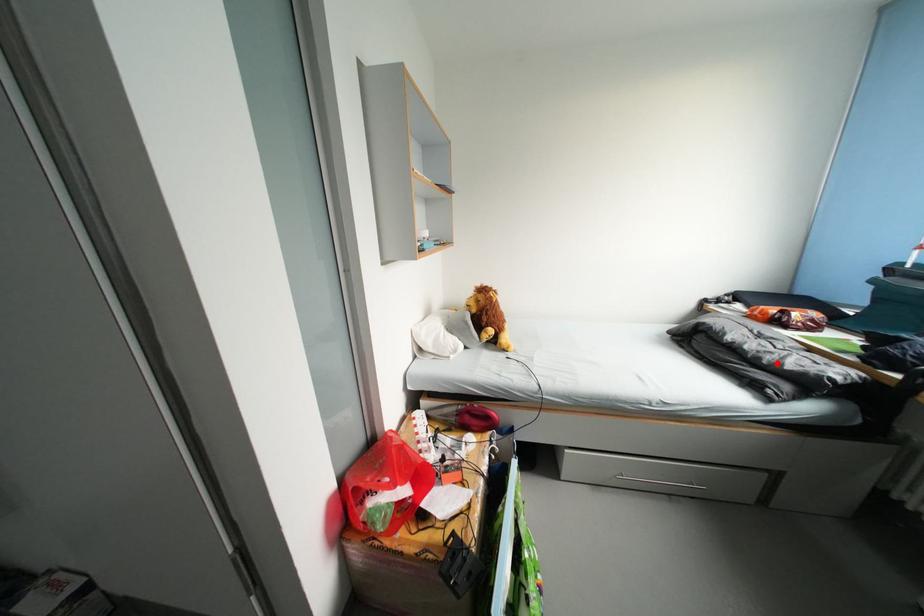
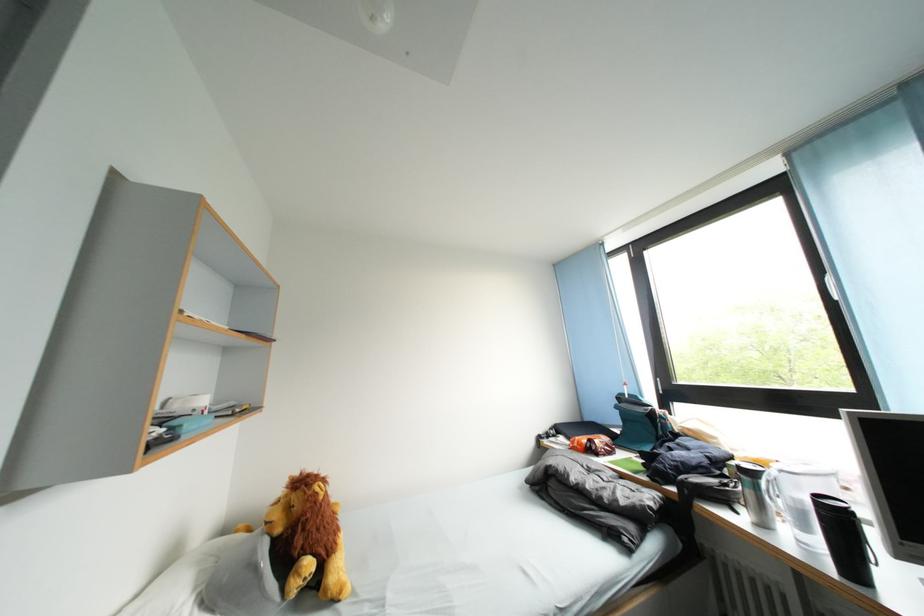
Where in the second image is the point corresponding to the highlighted location from the first image?

(614, 501)